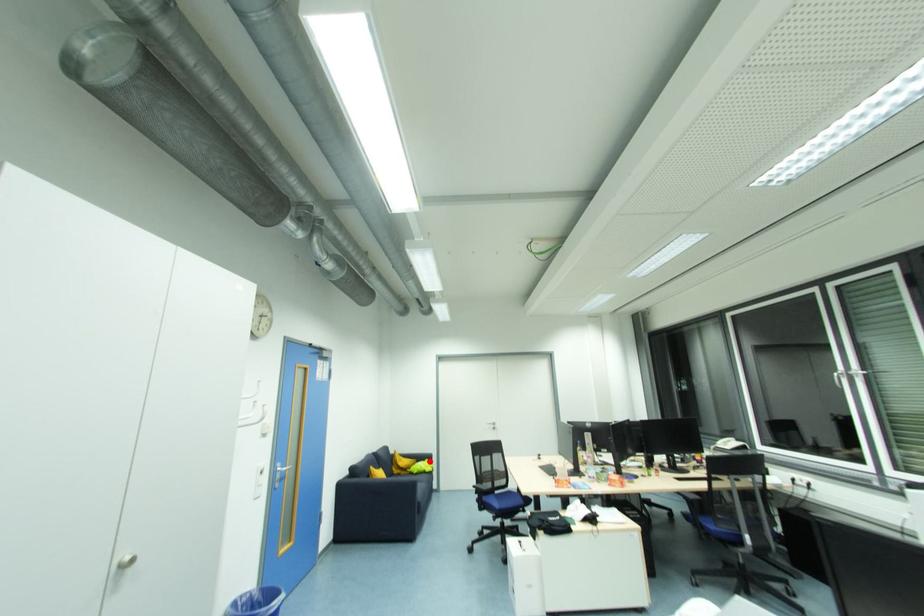
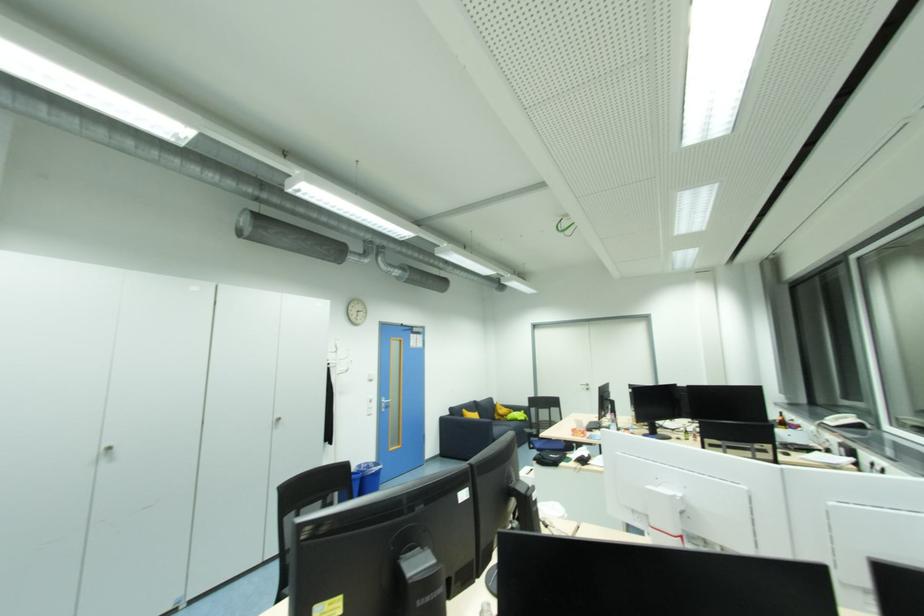
Question: I am providing you with two images of the same scene from different viewpoints. Image1 has a red point marked. In image2, the corresponding 3D location appears at what relative position? Reply with the corresponding letter.

Choices:
 (A) Closer
 (B) Farther

Answer: (B)